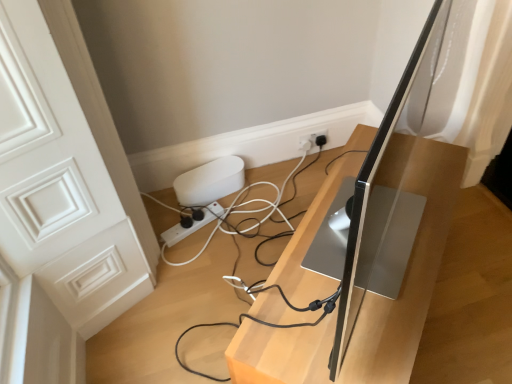
Locate an element on the screen. The width and height of the screenshot is (512, 384). free location to the right of silver metallic monitor at center is located at coordinates (471, 285).